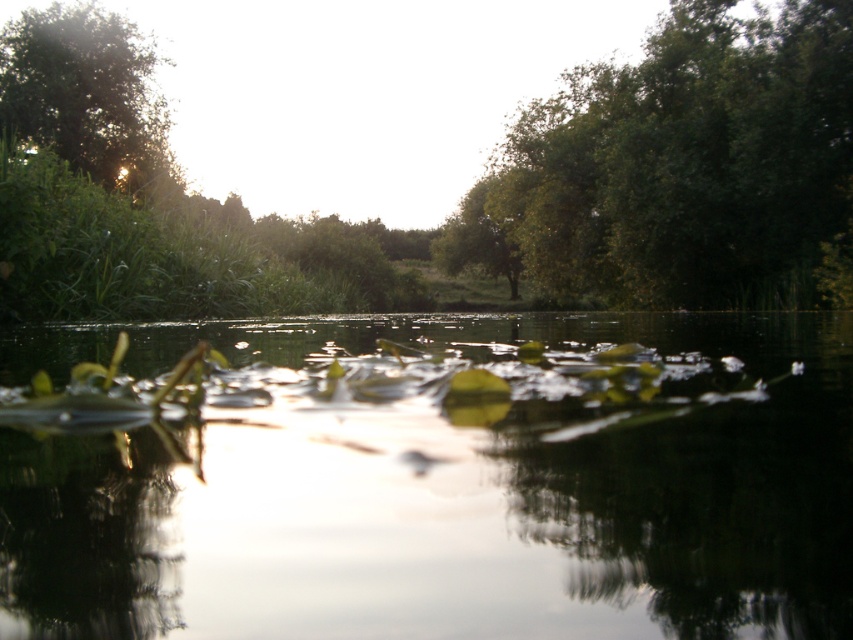
Question: From the image, what is the correct spatial relationship of green leafy tree at upper center in relation to green leafy tree at upper left?

Choices:
 (A) above
 (B) below

Answer: (B)

Question: Can you confirm if green leafy tree at upper center is positioned below green grass at upper left?

Choices:
 (A) no
 (B) yes

Answer: (A)

Question: Among these points, which one is nearest to the camera?

Choices:
 (A) (138, 205)
 (B) (96, 124)
 (C) (699, 36)
 (D) (779, 625)

Answer: (D)

Question: Which of the following is the farthest from the observer?

Choices:
 (A) green leafy tree at upper left
 (B) green leafy tree at upper center
 (C) green leafy plants at center
 (D) green grass at upper left

Answer: (B)

Question: Is green leafy plants at center bigger than green leafy tree at upper center?

Choices:
 (A) yes
 (B) no

Answer: (B)

Question: Estimate the real-world distances between objects in this image. Which object is farther from the green leafy tree at upper center?

Choices:
 (A) green grass at upper left
 (B) green leafy tree at upper left
 (C) green leafy plants at center

Answer: (C)